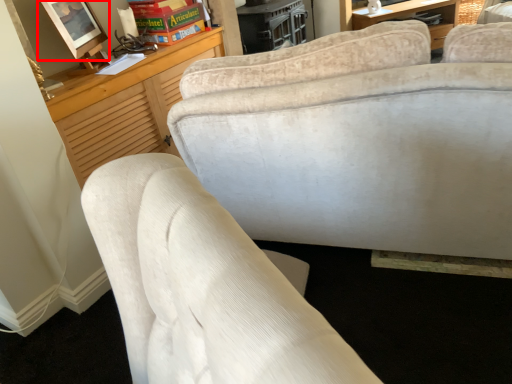
Question: From the image's perspective, where is picture frame (annotated by the red box) located in relation to book in the image?

Choices:
 (A) above
 (B) below

Answer: (B)